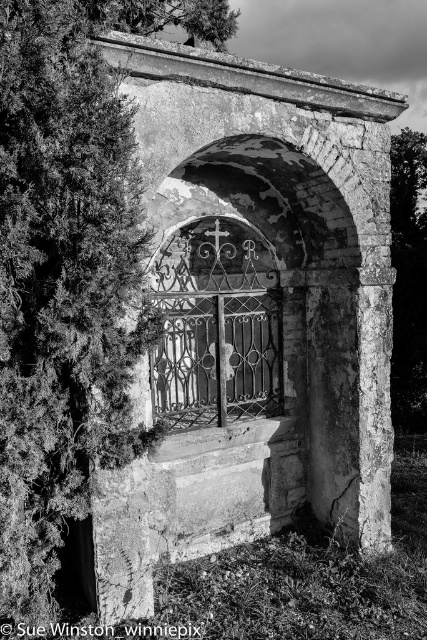
Question: Which point appears closest to the camera in this image?

Choices:
 (A) (248, 340)
 (B) (412, 182)

Answer: (A)

Question: Can you confirm if green leafy tree at left is wider than wrought iron gate at center?

Choices:
 (A) yes
 (B) no

Answer: (A)

Question: Is green leafy tree at left positioned at the back of green leafy tree at right?

Choices:
 (A) no
 (B) yes

Answer: (A)

Question: Is wrought iron gate at center below green leafy tree at right?

Choices:
 (A) no
 (B) yes

Answer: (B)

Question: Which object is closer to the camera taking this photo?

Choices:
 (A) wrought iron gate at center
 (B) green leafy tree at left

Answer: (B)

Question: Which of these objects is positioned farthest from the green leafy tree at left?

Choices:
 (A) green leafy tree at right
 (B) wrought iron gate at center

Answer: (A)